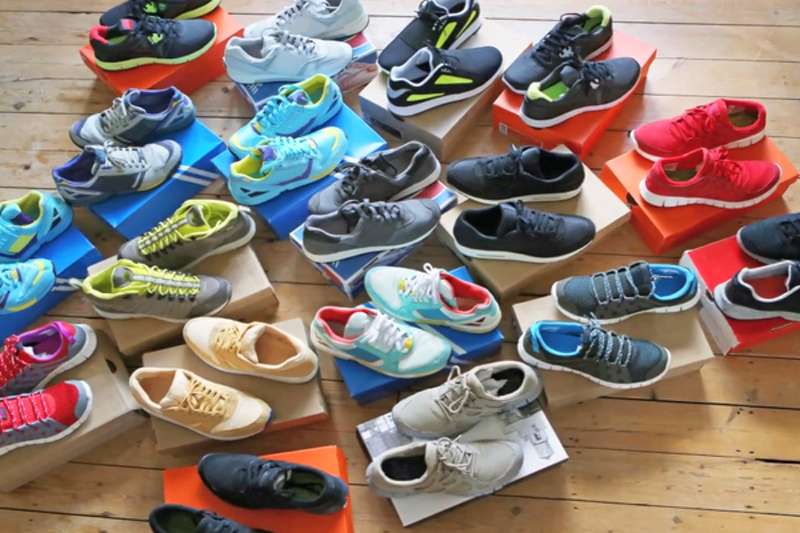
Where is `orange shoebox`? The image size is (800, 533). orange shoebox is located at coordinates (188, 480), (670, 222), (508, 96), (134, 78), (714, 271).